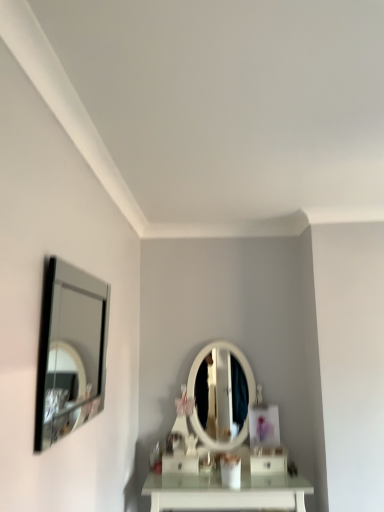
Question: Does white glossy drawer at center, arranged as the 2th drawer when viewed from the right, come in front of white glossy drawer at lower center, acting as the 1th drawer starting from the right?

Choices:
 (A) yes
 (B) no

Answer: (B)

Question: Does white glossy drawer at center, arranged as the first drawer when viewed from the left, come behind white glossy drawer at lower center, acting as the 1th drawer starting from the right?

Choices:
 (A) yes
 (B) no

Answer: (A)

Question: Could you tell me if white glossy drawer at center, arranged as the 2th drawer when viewed from the right, is turned towards white glossy drawer at lower center, which ranks as the second drawer in left-to-right order?

Choices:
 (A) no
 (B) yes

Answer: (A)

Question: Is white glossy drawer at center, arranged as the first drawer when viewed from the left, not near white glossy drawer at lower center, which ranks as the second drawer in left-to-right order?

Choices:
 (A) no
 (B) yes

Answer: (A)

Question: From the image's perspective, is white glossy drawer at center, arranged as the first drawer when viewed from the left, under white glossy drawer at lower center, which ranks as the second drawer in left-to-right order?

Choices:
 (A) yes
 (B) no

Answer: (A)

Question: Considering the positions of point (271, 458) and point (195, 462), is point (271, 458) closer or farther from the camera than point (195, 462)?

Choices:
 (A) closer
 (B) farther

Answer: (A)

Question: Is white glossy drawer at lower center, acting as the 1th drawer starting from the right, in front of or behind white glossy drawer at center, arranged as the first drawer when viewed from the left, in the image?

Choices:
 (A) front
 (B) behind

Answer: (A)

Question: Considering the relative positions of white glossy drawer at lower center, which ranks as the second drawer in left-to-right order, and white glossy drawer at center, arranged as the 2th drawer when viewed from the right, in the image provided, is white glossy drawer at lower center, which ranks as the second drawer in left-to-right order, to the left or to the right of white glossy drawer at center, arranged as the 2th drawer when viewed from the right,?

Choices:
 (A) right
 (B) left

Answer: (A)

Question: Is white glossy drawer at lower center, acting as the 1th drawer starting from the right, situated inside white glossy drawer at center, arranged as the 2th drawer when viewed from the right, or outside?

Choices:
 (A) inside
 (B) outside

Answer: (B)

Question: From their relative heights in the image, would you say silver-framed mirror at left is taller or shorter than white glossy drawer at center, arranged as the first drawer when viewed from the left?

Choices:
 (A) short
 (B) tall

Answer: (B)

Question: Considering the positions of silver-framed mirror at left and white glossy drawer at center, arranged as the 2th drawer when viewed from the right, in the image, is silver-framed mirror at left wider or thinner than white glossy drawer at center, arranged as the 2th drawer when viewed from the right,?

Choices:
 (A) thin
 (B) wide

Answer: (A)

Question: Based on their positions, is silver-framed mirror at left located to the left or right of white glossy drawer at center, arranged as the first drawer when viewed from the left?

Choices:
 (A) left
 (B) right

Answer: (A)

Question: Looking at the image, does silver-framed mirror at left seem bigger or smaller compared to white glossy drawer at center, arranged as the first drawer when viewed from the left?

Choices:
 (A) big
 (B) small

Answer: (A)

Question: From the image's perspective, relative to silver-framed mirror at left, is white glossy drawer at center, arranged as the first drawer when viewed from the left, above or below?

Choices:
 (A) above
 (B) below

Answer: (B)

Question: Is white glossy drawer at center, arranged as the 2th drawer when viewed from the right, inside or outside of silver-framed mirror at left?

Choices:
 (A) inside
 (B) outside

Answer: (B)